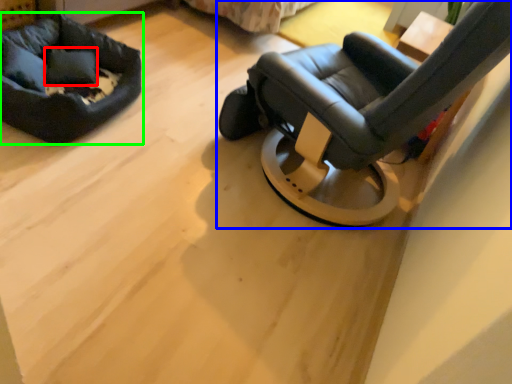
Question: Based on their relative distances, which object is nearer to pillow (highlighted by a red box)? Choose from chair (highlighted by a blue box) and dog bed (highlighted by a green box).

Choices:
 (A) chair
 (B) dog bed

Answer: (B)